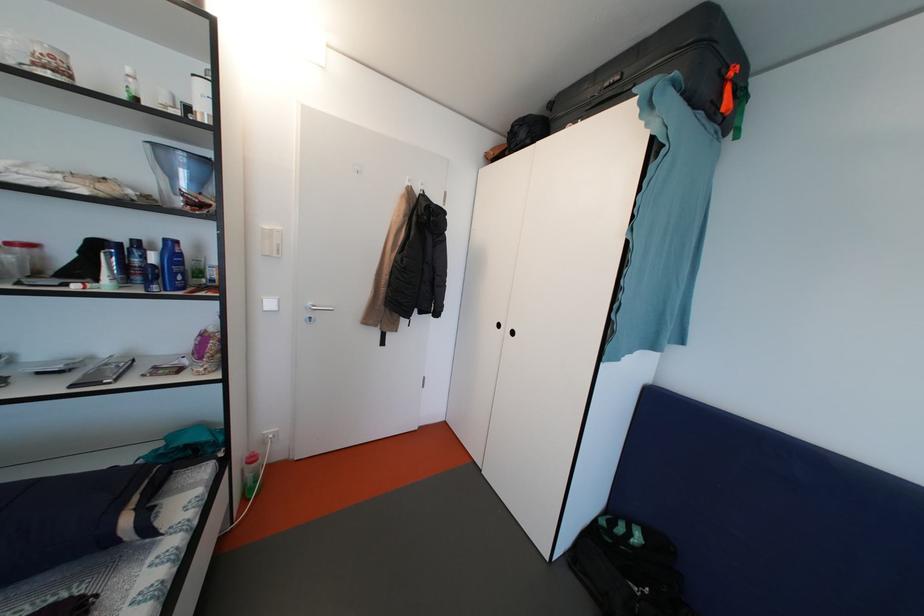
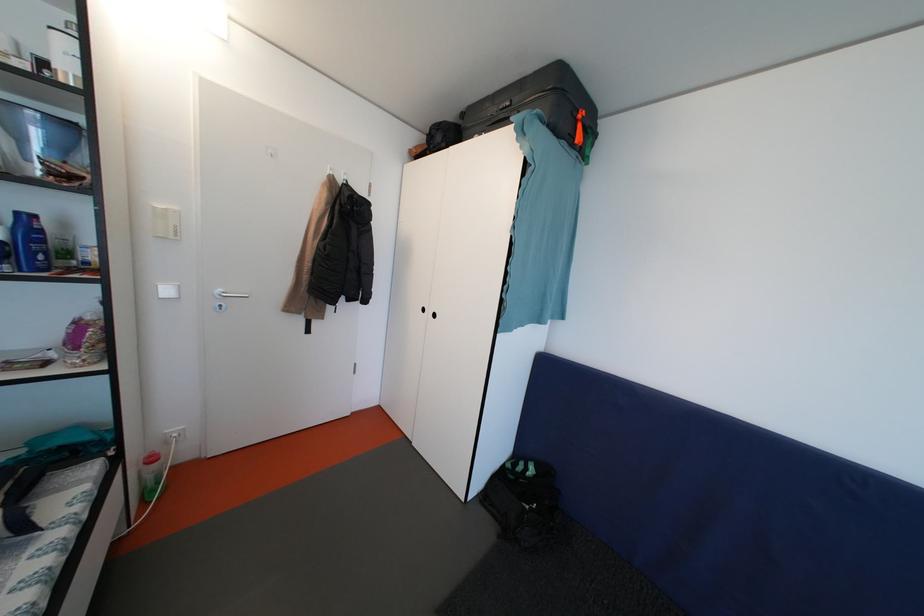
Find the pixel in the second image that matches the point at 260,464 in the first image.

(160, 464)